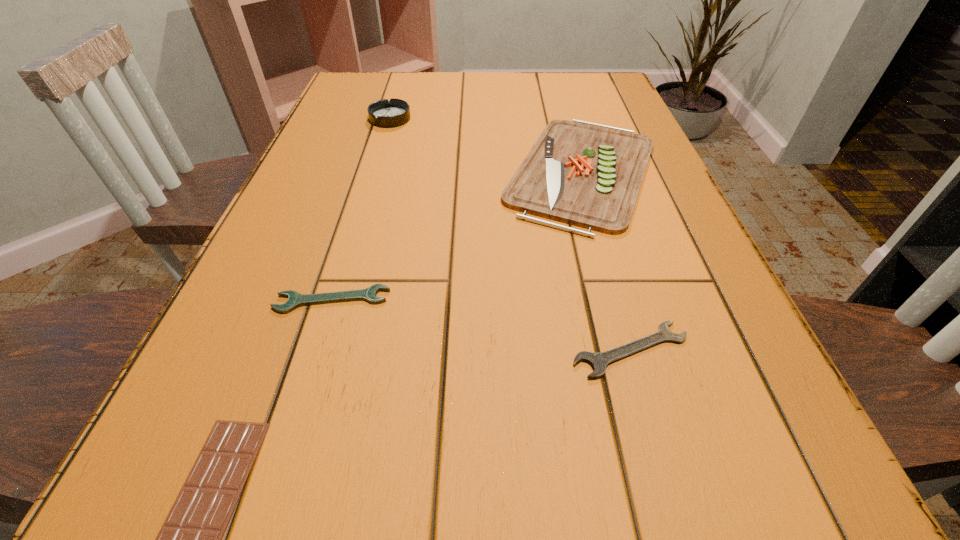
This screenshot has height=540, width=960. What are the coordinates of `unoccupied area between the chopping board and the right wrench` in the screenshot? It's located at (607, 261).

Identify the location of empty space that is in between the third farthest object and the nearer wrench. The image size is (960, 540). click(x=482, y=325).

You are a GUI agent. You are given a task and a screenshot of the screen. Output one action in this format:
    pyautogui.click(x=<x>, y=<y>)
    Task: Click on the blank region between the ashtray and the nearer wrench
    This screenshot has width=960, height=540.
    Given the screenshot: What is the action you would take?
    point(511,234)

Where is `free space between the chopping board and the ashtray`? The width and height of the screenshot is (960, 540). free space between the chopping board and the ashtray is located at coordinates (486, 145).

Identify the location of free space that is in between the left wrench and the nearer wrench. The width and height of the screenshot is (960, 540). (482, 325).

Where is `free point between the nearer wrench and the third farthest object`? The width and height of the screenshot is (960, 540). free point between the nearer wrench and the third farthest object is located at coordinates (482, 325).

The image size is (960, 540). Find the location of `empty space that is in between the chopping board and the third nearest object`. empty space that is in between the chopping board and the third nearest object is located at coordinates (457, 235).

At what (x,y) coordinates should I click in order to perform the action: click on the third closest object to the third farthest object. Please return your answer as a coordinate pair (x, y). Looking at the image, I should click on (599, 361).

In order to click on the third closest object to the third nearest object in this screenshot , I will do `click(599, 361)`.